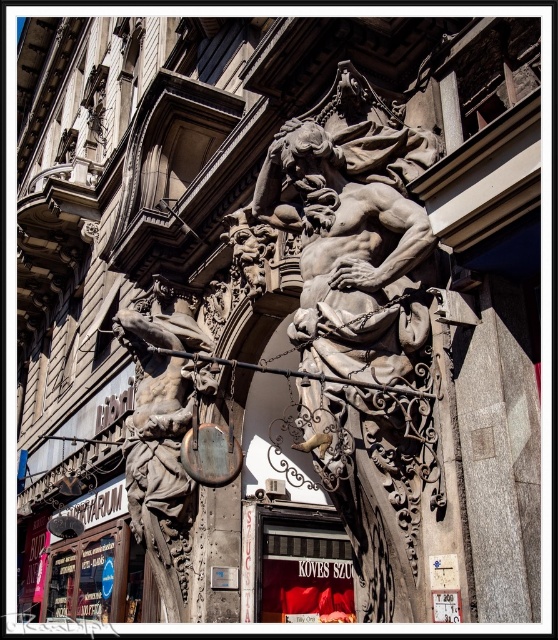
Does gray stone sculpture at center appear over polished bronze statue at left?

Yes, gray stone sculpture at center is above polished bronze statue at left.

Describe the element at coordinates (364, 337) in the screenshot. The image size is (558, 640). I see `gray stone sculpture at center` at that location.

You are a GUI agent. You are given a task and a screenshot of the screen. Output one action in this format:
    pyautogui.click(x=<x>, y=<y>)
    Task: Click on the gray stone sculpture at center
    This screenshot has height=640, width=558.
    Given the screenshot: What is the action you would take?
    pyautogui.click(x=364, y=337)